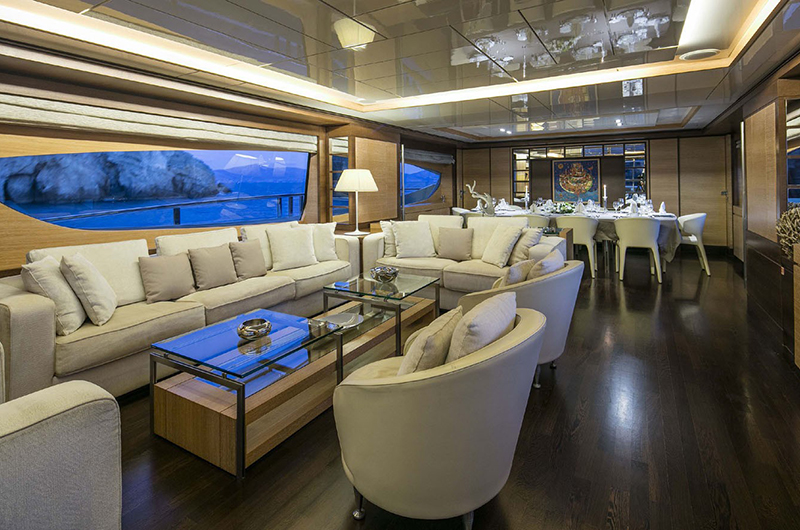
Where is `ashtray`? This screenshot has height=530, width=800. ashtray is located at coordinates (256, 329).